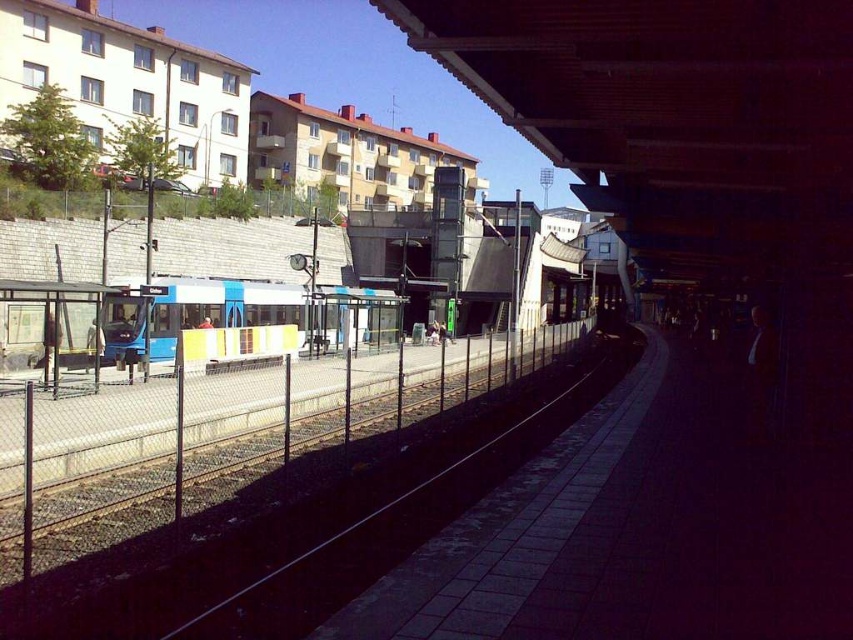
Does metal mesh fence at left appear over transparent plastic bus stop at left?

Incorrect, metal mesh fence at left is not positioned above transparent plastic bus stop at left.

Who is taller, metal mesh fence at left or transparent plastic bus stop at left?

Standing taller between the two is transparent plastic bus stop at left.

Image resolution: width=853 pixels, height=640 pixels. Identify the location of metal mesh fence at left. point(206,442).

Is point (303, 332) closer to camera compared to point (38, 301)?

No.

Does blue metallic train at center have a greater width compared to transparent plastic bus stop at left?

Yes.

Between point (372, 324) and point (19, 321), which one is positioned in front?

Point (19, 321) is more forward.

Locate an element on the screen. The width and height of the screenshot is (853, 640). blue metallic train at center is located at coordinates (244, 314).

Can you confirm if metal mesh fence at left is wider than blue metallic train at center?

Yes, metal mesh fence at left is wider than blue metallic train at center.

I want to click on metal mesh fence at left, so pos(206,442).

You are a GUI agent. You are given a task and a screenshot of the screen. Output one action in this format:
    pyautogui.click(x=<x>, y=<y>)
    Task: Click on the metal mesh fence at left
    The height and width of the screenshot is (640, 853).
    Given the screenshot: What is the action you would take?
    pyautogui.click(x=206, y=442)